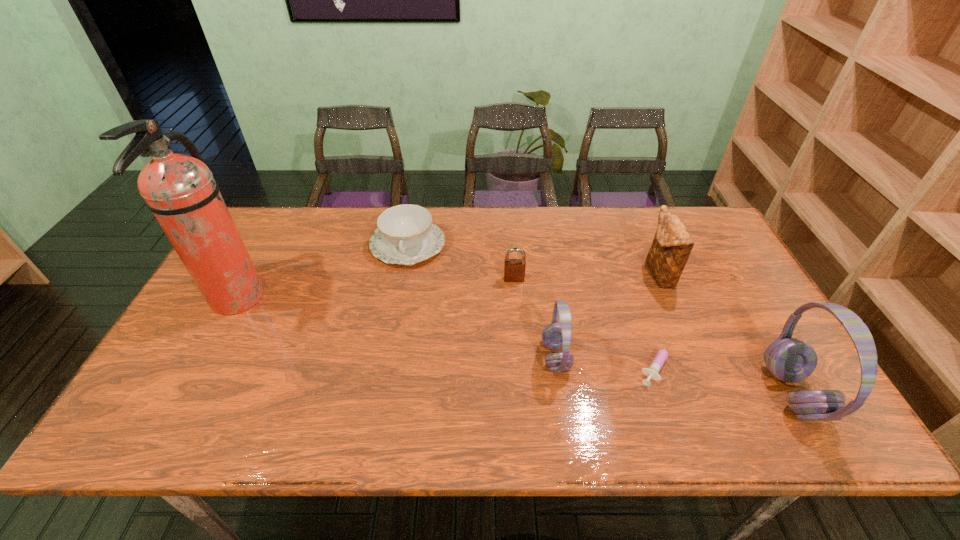
Where is `blank area at the far left corner`? blank area at the far left corner is located at coordinates (250, 222).

The image size is (960, 540). What are the coordinates of `vacant space at the near left corner of the desktop` in the screenshot? It's located at (204, 379).

Where is `vacant space at the near right corner of the desktop`? vacant space at the near right corner of the desktop is located at coordinates (738, 374).

At what (x,y) coordinates should I click in order to perform the action: click on free point between the fire extinguisher and the second object from left to right. Please return your answer as a coordinate pair (x, y). The image size is (960, 540). Looking at the image, I should click on (322, 272).

The height and width of the screenshot is (540, 960). In order to click on unoccupied position between the second shortest object and the tallest object in this screenshot , I will do `click(322, 272)`.

Where is `free spot between the rightmost object and the leftmost object`? free spot between the rightmost object and the leftmost object is located at coordinates (514, 346).

You are a GUI agent. You are given a task and a screenshot of the screen. Output one action in this format:
    pyautogui.click(x=<x>, y=<y>)
    Task: Click on the free spot between the syringe and the sixth object from right to left
    This screenshot has width=960, height=540.
    Given the screenshot: What is the action you would take?
    pyautogui.click(x=533, y=303)

Identify the location of blank region between the shortest object and the clutch bag. The image size is (960, 540). pyautogui.click(x=659, y=318).

Identify the location of free point between the fourth object from right to left and the third object from left to right. This screenshot has width=960, height=540. (535, 318).

Where is `vacant space that is in between the clutch bag and the syringe`? Image resolution: width=960 pixels, height=540 pixels. vacant space that is in between the clutch bag and the syringe is located at coordinates click(x=659, y=318).